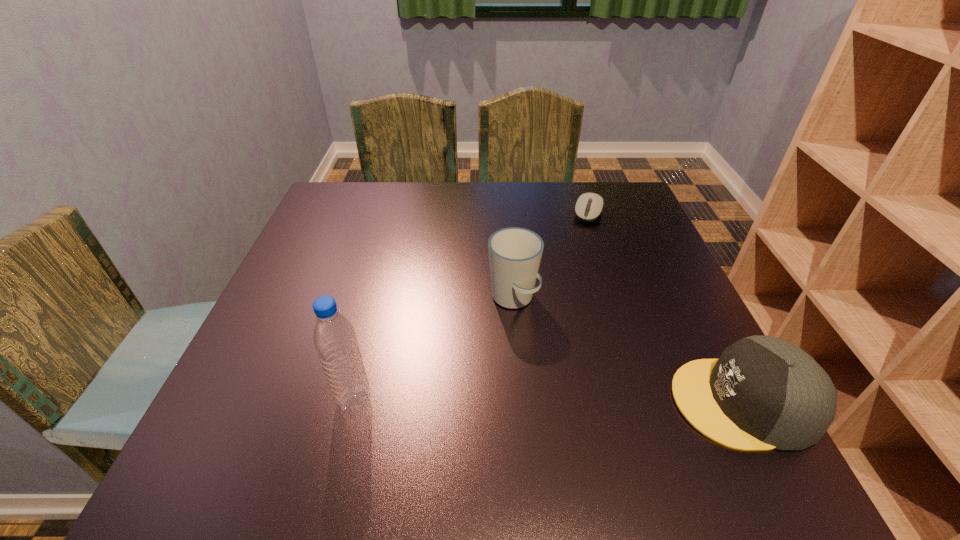
You are a GUI agent. You are given a task and a screenshot of the screen. Output one action in this format:
    pyautogui.click(x=<x>, y=<y>)
    Task: Click on the free spot on the desktop that is between the water bottle and the second shortest object and is positioned with a handle on the side of the second farthest object
    The height and width of the screenshot is (540, 960).
    Given the screenshot: What is the action you would take?
    [592, 401]

I want to click on free space on the desktop that is between the water bottle and the second shortest object and is positioned on the wheel side of the computer equipment, so click(516, 401).